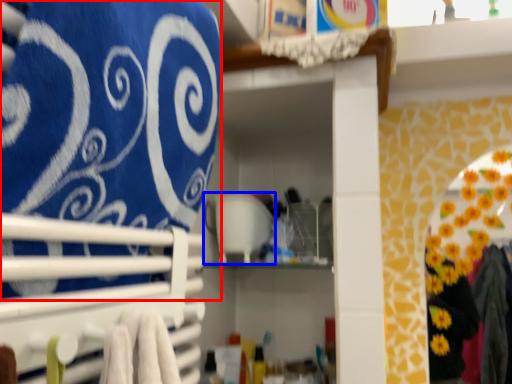
Question: Which of the following is the farthest to the observer, bath towel (highlighted by a red box) or appliance (highlighted by a blue box)?

Choices:
 (A) bath towel
 (B) appliance

Answer: (B)